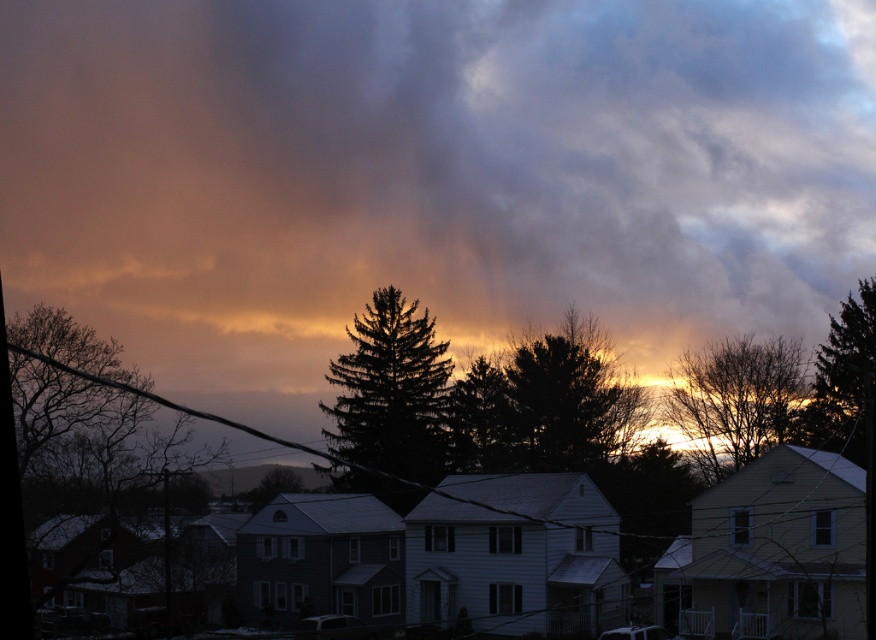
You are standing in the residential neighborhood and looking at the sky. There is a point marked at coordinates [843,380]. What object is located at that point?

The point at coordinates [843,380] indicates a dark green textured tree at upper right.

You are standing in the residential neighborhood shown in the image. A dark green textured tree at center is located at point 0.613, 0.447. If you want to walk directly towards the tree from your current position, which direction should you head?

The dark green textured tree at center is located at point [391,392], so you should head towards the center of the image to reach it.

Based on the scene description, what is located at the coordinates point (429, 177)?

dark gray cloud at upper center